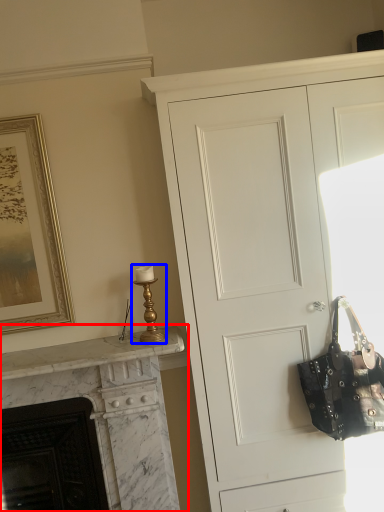
Question: Which of the following is the closest to the observer, fireplace (highlighted by a red box) or table lamp (highlighted by a blue box)?

Choices:
 (A) fireplace
 (B) table lamp

Answer: (A)